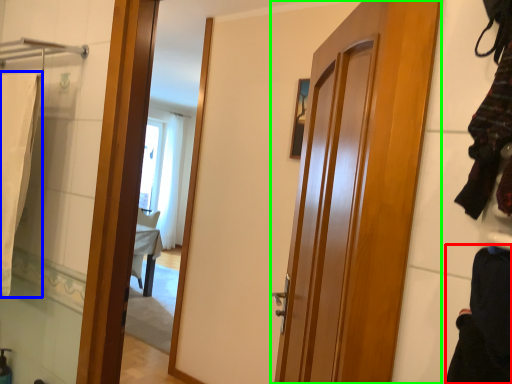
Question: Based on their relative distances, which object is nearer to clothing (highlighted by a red box)? Choose from bath towel (highlighted by a blue box) and door (highlighted by a green box).

Choices:
 (A) bath towel
 (B) door

Answer: (B)